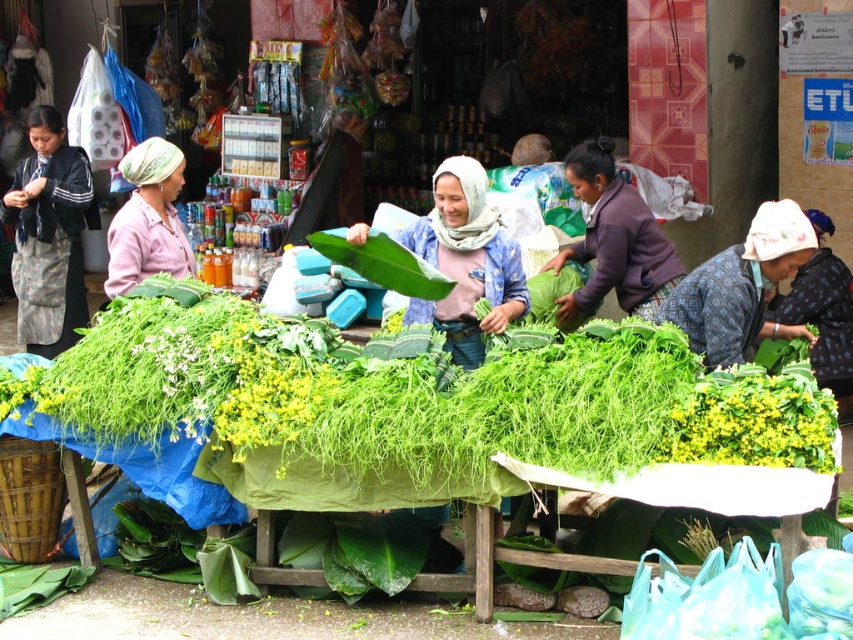
Question: Is green leafy vegetables at center above green leafy vegetable at center?

Choices:
 (A) no
 (B) yes

Answer: (A)

Question: Observing the image, what is the correct spatial positioning of printed fabric headscarf at lower right in reference to matte pink shirt at left?

Choices:
 (A) below
 (B) above

Answer: (A)

Question: Based on their relative distances, which object is farther from the green leafy vegetables at center?

Choices:
 (A) blue fabric headscarf at center
 (B) purple fabric at center
 (C) printed fabric headscarf at lower right

Answer: (B)

Question: Which point is closer to the camera?

Choices:
 (A) dark gray fabric at left
 (B) green leafy vegetables at center

Answer: (B)

Question: Among these objects, which one is farthest from the camera?

Choices:
 (A) blue fabric headscarf at center
 (B) printed fabric headscarf at lower right
 (C) dark gray fabric at left
 (D) matte pink shirt at left

Answer: (C)

Question: Is green leafy vegetables at center thinner than blue fabric headscarf at center?

Choices:
 (A) yes
 (B) no

Answer: (B)